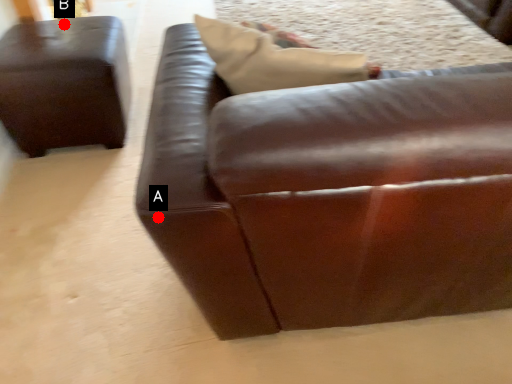
Question: Two points are circled on the image, labeled by A and B beside each circle. Among these points, which one is farthest from the camera?

Choices:
 (A) A is further
 (B) B is further

Answer: (B)